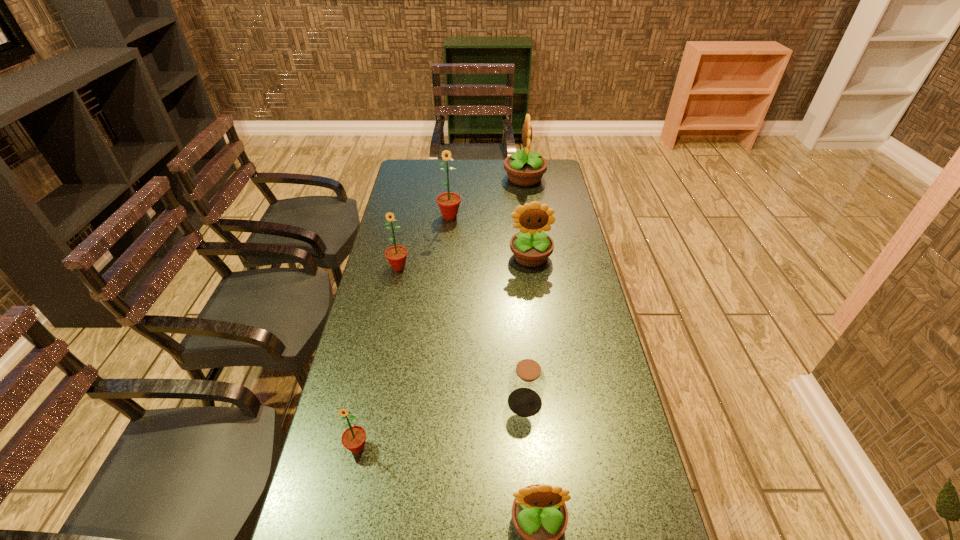
The height and width of the screenshot is (540, 960). Find the location of `vacant space at the far edge of the desktop`. vacant space at the far edge of the desktop is located at coordinates (504, 162).

In the image, there is a desktop. Identify the location of vacant space at the left edge. (416, 220).

In the image, there is a desktop. At what (x,y) coordinates should I click in order to perform the action: click on vacant space at the right edge. Please return your answer as a coordinate pair (x, y). Looking at the image, I should click on (579, 277).

In the image, there is a desktop. Where is `vacant region at the far left corner`? This screenshot has height=540, width=960. vacant region at the far left corner is located at coordinates (402, 178).

Where is `free space between the shortest object and the second nearest green sunflower`? The image size is (960, 540). free space between the shortest object and the second nearest green sunflower is located at coordinates (462, 335).

Locate an element on the screen. The width and height of the screenshot is (960, 540). unoccupied position between the second farthest green sunflower and the second nearest sunflower is located at coordinates (378, 357).

The width and height of the screenshot is (960, 540). In order to click on vacant region between the brown jar and the second smallest green sunflower in this screenshot , I will do `click(462, 335)`.

Identify the location of vacant point located between the biggest yellow sunflower and the farthest green sunflower. This screenshot has height=540, width=960. (487, 197).

I want to click on blank region between the fifth farthest sunflower and the second farthest sunflower, so click(x=403, y=332).

This screenshot has width=960, height=540. Identify the location of object that is the sixth nearest to the second smallest green sunflower. (539, 514).